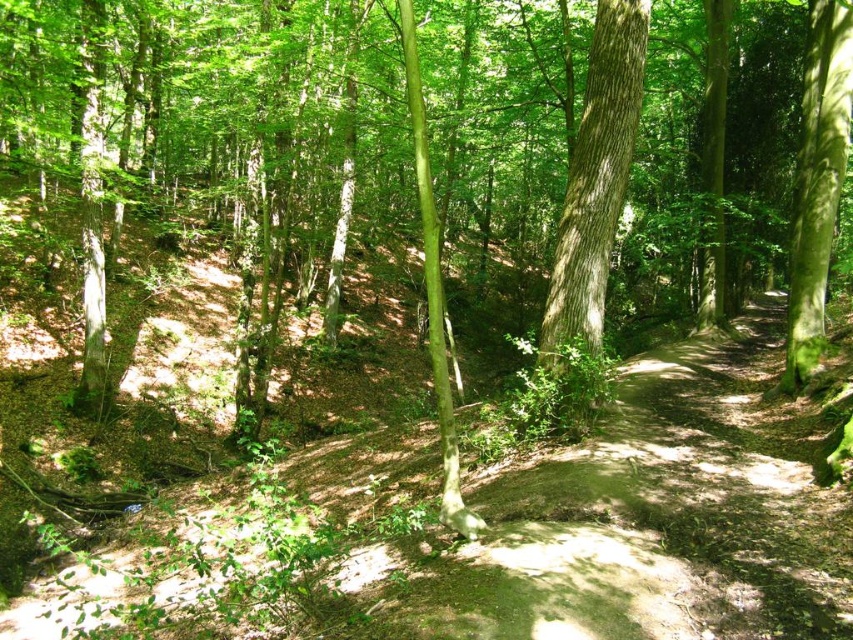
Question: Does smooth bark tree at center have a larger size compared to green mossy tree at right?

Choices:
 (A) no
 (B) yes

Answer: (A)

Question: Can you confirm if smooth bark tree at center is positioned below green mossy tree at right?

Choices:
 (A) yes
 (B) no

Answer: (A)

Question: Which object appears farthest from the camera in this image?

Choices:
 (A) green mossy tree at right
 (B) smooth bark tree at center

Answer: (B)

Question: Is smooth bark tree at center to the right of green mossy tree at right from the viewer's perspective?

Choices:
 (A) yes
 (B) no

Answer: (B)

Question: Among these points, which one is nearest to the camera?

Choices:
 (A) (808, 125)
 (B) (608, 40)

Answer: (B)